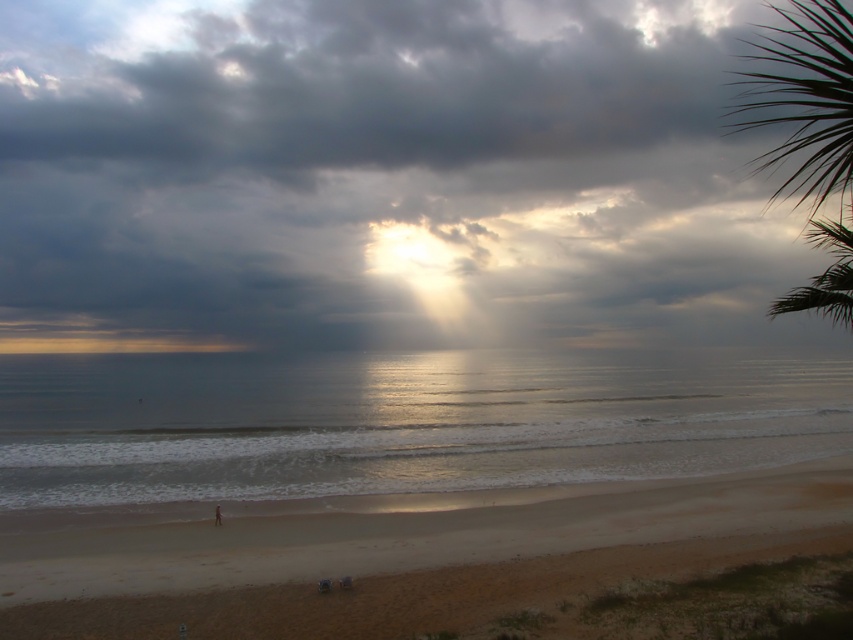
Between dark gray cloud at upper center and brown sandy beach at lower center, which one appears on the right side from the viewer's perspective?

Positioned to the right is brown sandy beach at lower center.

Is point (733, 26) positioned after point (368, 595)?

Yes, point (733, 26) is farther from viewer.

At what (x,y) coordinates should I click in order to perform the action: click on dark gray cloud at upper center. Please return your answer as a coordinate pair (x, y). The image size is (853, 640). Looking at the image, I should click on (380, 177).

Can you confirm if smooth blue water at center is positioned above brown sandy beach at lower center?

No, smooth blue water at center is not above brown sandy beach at lower center.

Can you confirm if smooth blue water at center is bigger than brown sandy beach at lower center?

Yes, smooth blue water at center is bigger than brown sandy beach at lower center.

This screenshot has width=853, height=640. What do you see at coordinates (399, 422) in the screenshot?
I see `smooth blue water at center` at bounding box center [399, 422].

The height and width of the screenshot is (640, 853). I want to click on smooth blue water at center, so click(x=399, y=422).

Can you confirm if dark gray cloud at upper center is wider than green leafy palm tree at upper right?

Indeed, dark gray cloud at upper center has a greater width compared to green leafy palm tree at upper right.

Can you confirm if dark gray cloud at upper center is positioned to the right of green leafy palm tree at upper right?

Incorrect, dark gray cloud at upper center is not on the right side of green leafy palm tree at upper right.

Between point (347, 291) and point (833, 237), which one is positioned in front?

Positioned in front is point (833, 237).

Image resolution: width=853 pixels, height=640 pixels. What are the coordinates of `dark gray cloud at upper center` in the screenshot? It's located at (380, 177).